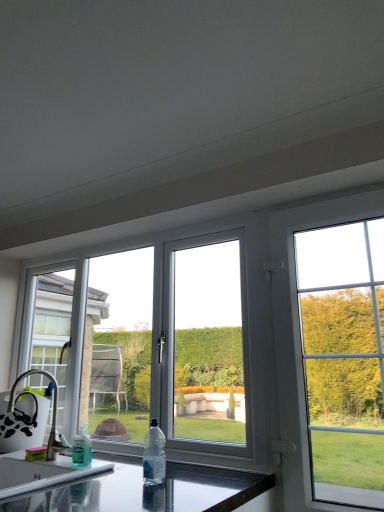
The height and width of the screenshot is (512, 384). What do you see at coordinates (30, 422) in the screenshot?
I see `silver metallic faucet at lower left` at bounding box center [30, 422].

Identify the location of white plastic window at center, positioned as the 1th window in left-to-right order. (181, 350).

The image size is (384, 512). What are the coordinates of `white plastic window at upper right, which appears as the second window when viewed from the left` in the screenshot? It's located at (336, 346).

The height and width of the screenshot is (512, 384). Describe the element at coordinates (148, 490) in the screenshot. I see `black glossy countertop at lower center` at that location.

Describe the element at coordinates (154, 455) in the screenshot. The image size is (384, 512). I see `clear plastic bottle at center, the 2th bottle when ordered from back to front` at that location.

This screenshot has width=384, height=512. Identify the location of silver metallic faucet at lower left. (30, 422).

Does white plastic window at upper right, the 1th window from the right, have a greater height compared to black glossy countertop at lower center?

Correct, white plastic window at upper right, the 1th window from the right, is much taller as black glossy countertop at lower center.

Is white plastic window at upper right, which appears as the second window when viewed from the left, oriented towards black glossy countertop at lower center?

No, white plastic window at upper right, which appears as the second window when viewed from the left, is not oriented towards black glossy countertop at lower center.

From the image's perspective, who appears lower, white plastic window at upper right, the 1th window from the right, or black glossy countertop at lower center?

black glossy countertop at lower center appears lower in the image.

From a real-world perspective, who is located higher, clear plastic bottle at center, placed as the first bottle when sorted from right to left, or white plastic window at center, the second window positioned from the right?

white plastic window at center, the second window positioned from the right.

From the image's perspective, who appears lower, clear plastic bottle at center, the 2th bottle when ordered from back to front, or white plastic window at center, positioned as the 1th window in left-to-right order?

clear plastic bottle at center, the 2th bottle when ordered from back to front, is shown below in the image.

Is point (162, 466) more distant than point (129, 334)?

No, (162, 466) is in front of (129, 334).

Is clear plastic bottle at center, the 1th bottle from the front, wider or thinner than white plastic window at center, the second window positioned from the right?

clear plastic bottle at center, the 1th bottle from the front, is thinner than white plastic window at center, the second window positioned from the right.

From their relative heights in the image, would you say clear plastic bottle at lower left, positioned as the 1th bottle in left-to-right order, is taller or shorter than clear plastic bottle at center, the 1th bottle from the front?

In the image, clear plastic bottle at lower left, positioned as the 1th bottle in left-to-right order, appears to be shorter than clear plastic bottle at center, the 1th bottle from the front.

From the image's perspective, is clear plastic bottle at lower left, positioned as the 1th bottle in left-to-right order, beneath clear plastic bottle at center, the 1th bottle from the front?

Yes, from the image's perspective, clear plastic bottle at lower left, positioned as the 1th bottle in left-to-right order, is below clear plastic bottle at center, the 1th bottle from the front.

Does clear plastic bottle at lower left, the second bottle viewed from the front, have a greater width compared to clear plastic bottle at center, arranged as the second bottle when viewed from the left?

Correct, the width of clear plastic bottle at lower left, the second bottle viewed from the front, exceeds that of clear plastic bottle at center, arranged as the second bottle when viewed from the left.

Which object is positioned more to the left, clear plastic bottle at lower left, the first bottle positioned from the back, or clear plastic bottle at center, the 1th bottle from the front?

clear plastic bottle at lower left, the first bottle positioned from the back, is more to the left.

From the image's perspective, between white plastic window at center, the second window positioned from the right, and white plastic window at upper right, which appears as the second window when viewed from the left, who is located below?

white plastic window at center, the second window positioned from the right, from the image's perspective.

Considering the positions of objects white plastic window at center, the second window positioned from the right, and white plastic window at upper right, the 1th window from the right, in the image provided, who is more to the left, white plastic window at center, the second window positioned from the right, or white plastic window at upper right, the 1th window from the right,?

From the viewer's perspective, white plastic window at center, the second window positioned from the right, appears more on the left side.

Are white plastic window at center, the second window positioned from the right, and white plastic window at upper right, the 1th window from the right, making contact?

They are not placed beside each other.

Relative to white plastic window at upper right, the 1th window from the right, is white plastic window at center, positioned as the 1th window in left-to-right order, in front or behind?

white plastic window at center, positioned as the 1th window in left-to-right order, is behind white plastic window at upper right, the 1th window from the right.

At what (x,y) coordinates should I click in order to perform the action: click on the 2nd bottle positioned above the black glossy countertop at lower center (from a real-world perspective). Please return your answer as a coordinate pair (x, y). Looking at the image, I should click on (154, 455).

Considering the positions of point (94, 480) and point (159, 446), is point (94, 480) closer or farther from the camera than point (159, 446)?

Point (94, 480).

How many degrees apart are the facing directions of black glossy countertop at lower center and clear plastic bottle at center, the 1th bottle from the front?

There is a 2.49-degree angle between the facing directions of black glossy countertop at lower center and clear plastic bottle at center, the 1th bottle from the front.

Does black glossy countertop at lower center have a lesser height compared to clear plastic bottle at center, the 1th bottle from the front?

In fact, black glossy countertop at lower center may be taller than clear plastic bottle at center, the 1th bottle from the front.

Is white plastic window at upper right, which appears as the second window when viewed from the left, in front of clear plastic bottle at lower left, positioned as the 1th bottle in left-to-right order?

Yes, white plastic window at upper right, which appears as the second window when viewed from the left, is in front of clear plastic bottle at lower left, positioned as the 1th bottle in left-to-right order.

Is white plastic window at upper right, which appears as the second window when viewed from the left, not near clear plastic bottle at lower left, positioned as the 1th bottle in left-to-right order?

Yes, white plastic window at upper right, which appears as the second window when viewed from the left, is far from clear plastic bottle at lower left, positioned as the 1th bottle in left-to-right order.

From a real-world perspective, which is physically above, white plastic window at upper right, the 1th window from the right, or clear plastic bottle at lower left, the second bottle positioned from the right?

From a 3D spatial view, white plastic window at upper right, the 1th window from the right, is above.

From the image's perspective, is white plastic window at upper right, the 1th window from the right, located beneath clear plastic bottle at lower left, the first bottle positioned from the back?

Incorrect, from the image's perspective, white plastic window at upper right, the 1th window from the right, is higher than clear plastic bottle at lower left, the first bottle positioned from the back.

Is silver metallic faucet at lower left far away from white plastic window at center, positioned as the 1th window in left-to-right order?

No.

Is silver metallic faucet at lower left facing towards white plastic window at center, positioned as the 1th window in left-to-right order?

No, silver metallic faucet at lower left is not facing towards white plastic window at center, positioned as the 1th window in left-to-right order.

Would you say silver metallic faucet at lower left is outside white plastic window at center, the second window positioned from the right?

Yes, silver metallic faucet at lower left is located beyond the bounds of white plastic window at center, the second window positioned from the right.

Which is in front, silver metallic faucet at lower left or white plastic window at center, the second window positioned from the right?

white plastic window at center, the second window positioned from the right, is in front.

Locate an element on the screen. This screenshot has height=512, width=384. countertop below the white plastic window at upper right, which appears as the second window when viewed from the left (from the image's perspective) is located at coordinates (148, 490).

Where is `bottle in front of the white plastic window at center, positioned as the 1th window in left-to-right order`? The image size is (384, 512). bottle in front of the white plastic window at center, positioned as the 1th window in left-to-right order is located at coordinates (154, 455).

In the scene shown: Considering their positions, is black glossy countertop at lower center positioned closer to clear plastic bottle at center, the 1th bottle from the front, than silver metallic faucet at lower left?

black glossy countertop at lower center is closer to clear plastic bottle at center, the 1th bottle from the front.

Based on the photo, estimate the real-world distances between objects in this image. Which object is closer to white plastic window at upper right, which appears as the second window when viewed from the left, black glossy countertop at lower center or silver metallic faucet at lower left?

black glossy countertop at lower center is closer to white plastic window at upper right, which appears as the second window when viewed from the left.

Estimate the real-world distances between objects in this image. Which object is closer to white plastic window at center, positioned as the 1th window in left-to-right order, black glossy countertop at lower center or clear plastic bottle at lower left, positioned as the 1th bottle in left-to-right order?

The object closer to white plastic window at center, positioned as the 1th window in left-to-right order, is black glossy countertop at lower center.

Looking at this image, which object lies further to the anchor point clear plastic bottle at lower left, the first bottle positioned from the back, white plastic window at center, the second window positioned from the right, or silver metallic faucet at lower left?

Among the two, white plastic window at center, the second window positioned from the right, is located further to clear plastic bottle at lower left, the first bottle positioned from the back.

Based on their spatial positions, is white plastic window at upper right, which appears as the second window when viewed from the left, or white plastic window at center, positioned as the 1th window in left-to-right order, closer to silver metallic faucet at lower left?

white plastic window at center, positioned as the 1th window in left-to-right order, is closer to silver metallic faucet at lower left.

Looking at this image, when comparing their distances from silver metallic faucet at lower left, does white plastic window at upper right, the 1th window from the right, or clear plastic bottle at center, the 2th bottle when ordered from back to front, seem closer?

clear plastic bottle at center, the 2th bottle when ordered from back to front.

Based on their spatial positions, is clear plastic bottle at center, placed as the first bottle when sorted from right to left, or black glossy countertop at lower center closer to silver metallic faucet at lower left?

black glossy countertop at lower center.

Looking at the image, which one is located further to white plastic window at upper right, which appears as the second window when viewed from the left, silver metallic faucet at lower left or clear plastic bottle at center, the 1th bottle from the front?

silver metallic faucet at lower left is positioned further to the anchor white plastic window at upper right, which appears as the second window when viewed from the left.

The image size is (384, 512). Find the location of `window between clear plastic bottle at lower left, positioned as the 1th bottle in left-to-right order, and white plastic window at upper right, the 1th window from the right, from left to right`. window between clear plastic bottle at lower left, positioned as the 1th bottle in left-to-right order, and white plastic window at upper right, the 1th window from the right, from left to right is located at coordinates 181,350.

The image size is (384, 512). I want to click on bottle between black glossy countertop at lower center and white plastic window at upper right, which appears as the second window when viewed from the left, in the horizontal direction, so click(154, 455).

The image size is (384, 512). I want to click on bottle between black glossy countertop at lower center and clear plastic bottle at lower left, the first bottle positioned from the back, in the front-back direction, so click(x=154, y=455).

The width and height of the screenshot is (384, 512). In order to click on countertop situated between clear plastic bottle at lower left, the second bottle viewed from the front, and white plastic window at upper right, which appears as the second window when viewed from the left, from left to right in this screenshot , I will do `click(148, 490)`.